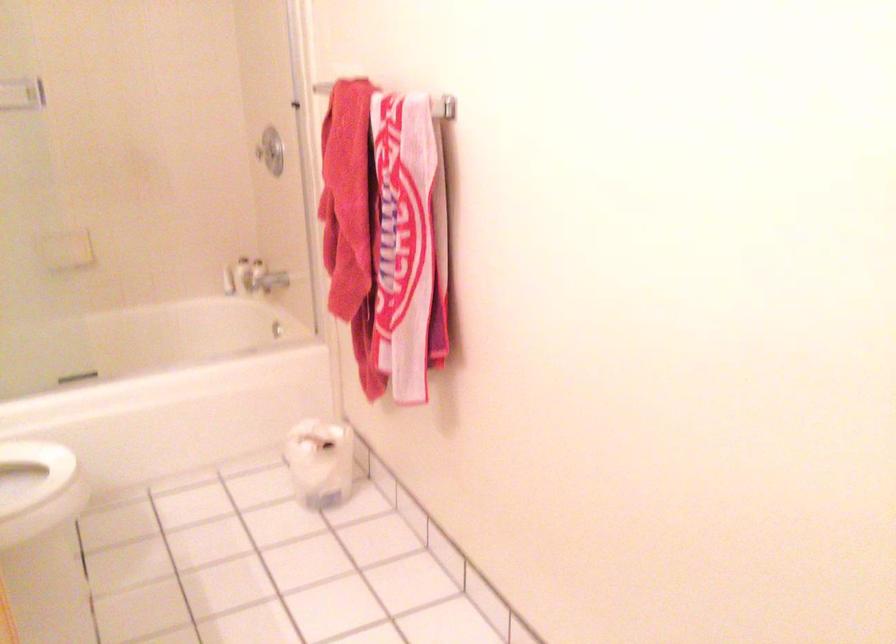
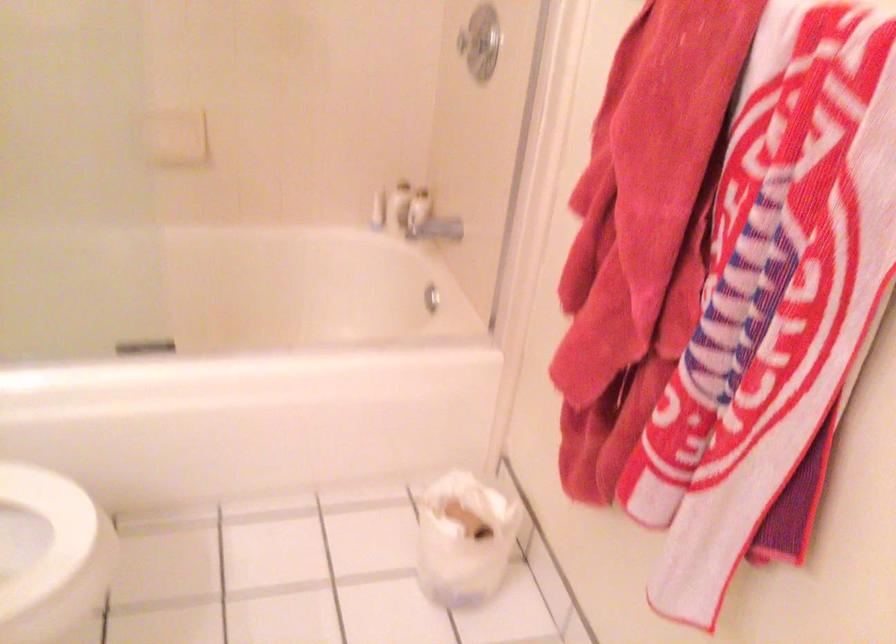
The point at (266, 281) is marked in the first image. Where is the corresponding point in the second image?

(429, 221)